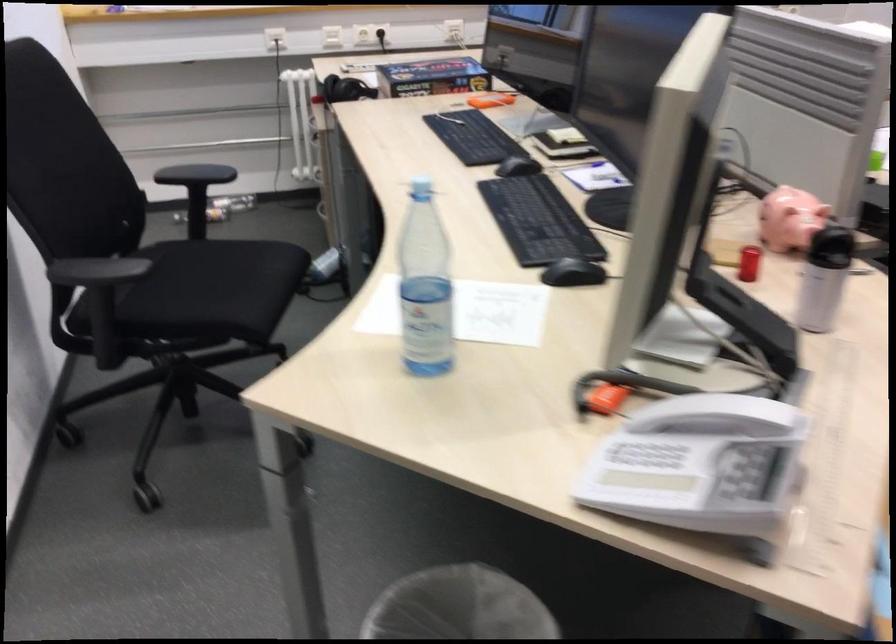
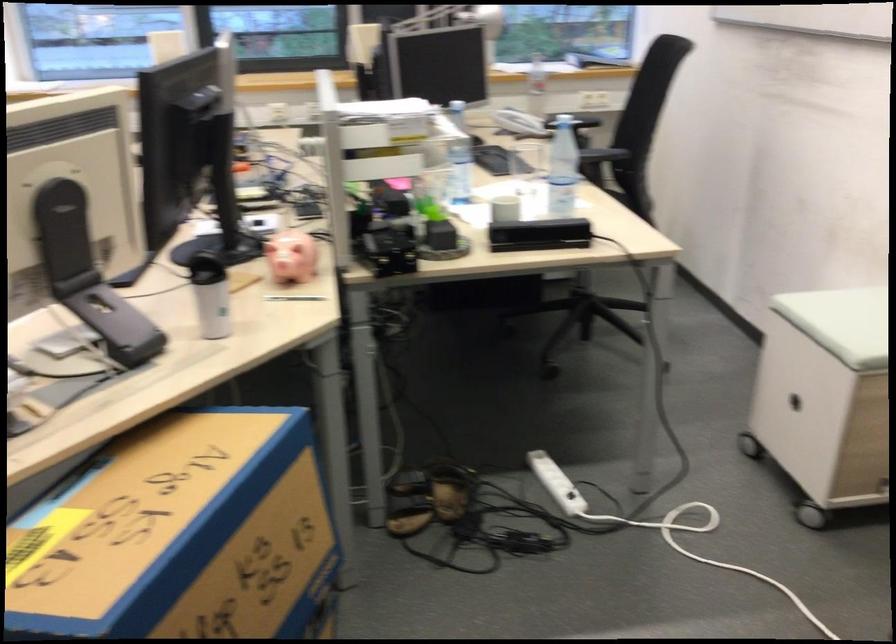
In the second image, find the point that corresponds to point 699,257 in the first image.

(88, 275)